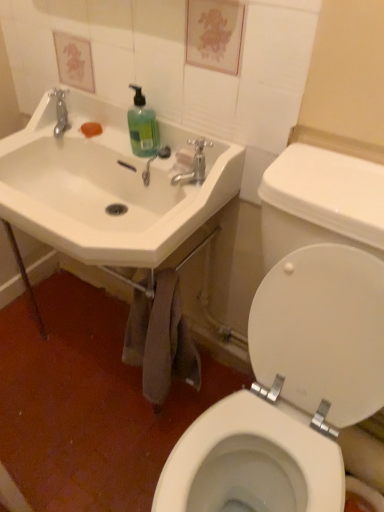
Question: Does white glossy toilet lid at right appear on the left side of matte silver faucet at upper center?

Choices:
 (A) yes
 (B) no

Answer: (B)

Question: Is white glossy toilet lid at right smaller than matte silver faucet at upper center?

Choices:
 (A) yes
 (B) no

Answer: (B)

Question: Considering the relative sizes of white glossy toilet lid at right and matte silver faucet at upper center in the image provided, is white glossy toilet lid at right wider than matte silver faucet at upper center?

Choices:
 (A) no
 (B) yes

Answer: (A)

Question: From the image's perspective, does white glossy toilet lid at right appear higher than matte silver faucet at upper center?

Choices:
 (A) no
 (B) yes

Answer: (A)

Question: Is the position of white glossy toilet lid at right less distant than that of matte silver faucet at upper center?

Choices:
 (A) no
 (B) yes

Answer: (B)

Question: Is matte silver faucet at upper center wider or thinner than green matte liquid soap at upper center?

Choices:
 (A) wide
 (B) thin

Answer: (A)

Question: Is matte silver faucet at upper center in front of or behind green matte liquid soap at upper center in the image?

Choices:
 (A) behind
 (B) front

Answer: (B)

Question: Considering the positions of matte silver faucet at upper center and green matte liquid soap at upper center in the image, is matte silver faucet at upper center taller or shorter than green matte liquid soap at upper center?

Choices:
 (A) short
 (B) tall

Answer: (A)

Question: Is matte silver faucet at upper center inside the boundaries of green matte liquid soap at upper center, or outside?

Choices:
 (A) outside
 (B) inside

Answer: (A)

Question: From a real-world perspective, relative to white ceramic sink at upper left, is translucent plastic faucet at upper center vertically above or below?

Choices:
 (A) above
 (B) below

Answer: (A)

Question: Based on their positions, is translucent plastic faucet at upper center located to the left or right of white ceramic sink at upper left?

Choices:
 (A) left
 (B) right

Answer: (B)

Question: Considering the positions of translucent plastic faucet at upper center and white ceramic sink at upper left in the image, is translucent plastic faucet at upper center taller or shorter than white ceramic sink at upper left?

Choices:
 (A) short
 (B) tall

Answer: (A)

Question: In the image, is translucent plastic faucet at upper center positioned in front of or behind white ceramic sink at upper left?

Choices:
 (A) behind
 (B) front

Answer: (A)

Question: Does point (142, 119) appear closer or farther from the camera than point (350, 285)?

Choices:
 (A) farther
 (B) closer

Answer: (A)

Question: In terms of height, does green matte liquid soap at upper center look taller or shorter compared to white glossy toilet lid at right?

Choices:
 (A) tall
 (B) short

Answer: (B)